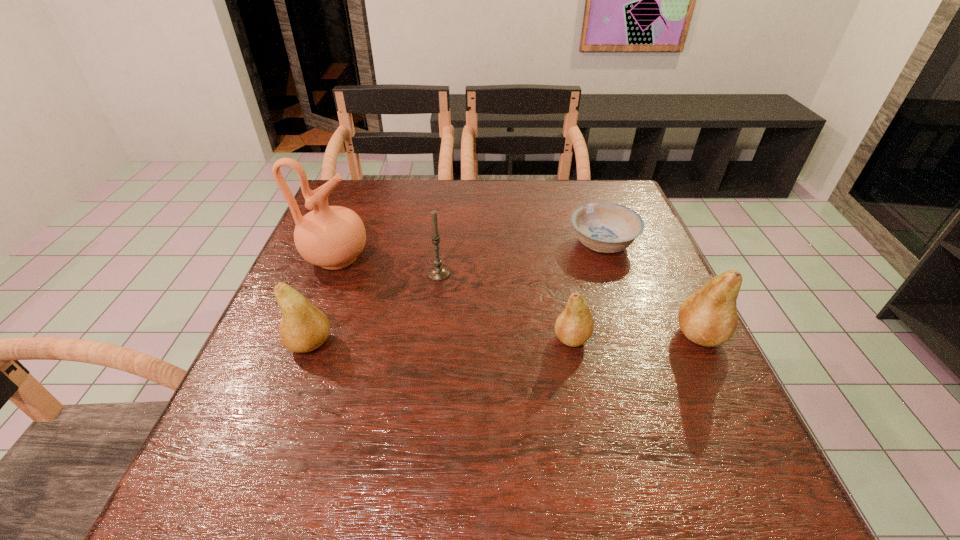
Where is `vacant area that satisfies the following two spatial constraints: 1. on the spout of the tallest object; 2. on the back side of the candle`? The width and height of the screenshot is (960, 540). vacant area that satisfies the following two spatial constraints: 1. on the spout of the tallest object; 2. on the back side of the candle is located at coordinates (330, 274).

I want to click on free space in the image that satisfies the following two spatial constraints: 1. on the front side of the second pear from left to right; 2. on the left side of the fourth object from right to left, so click(432, 338).